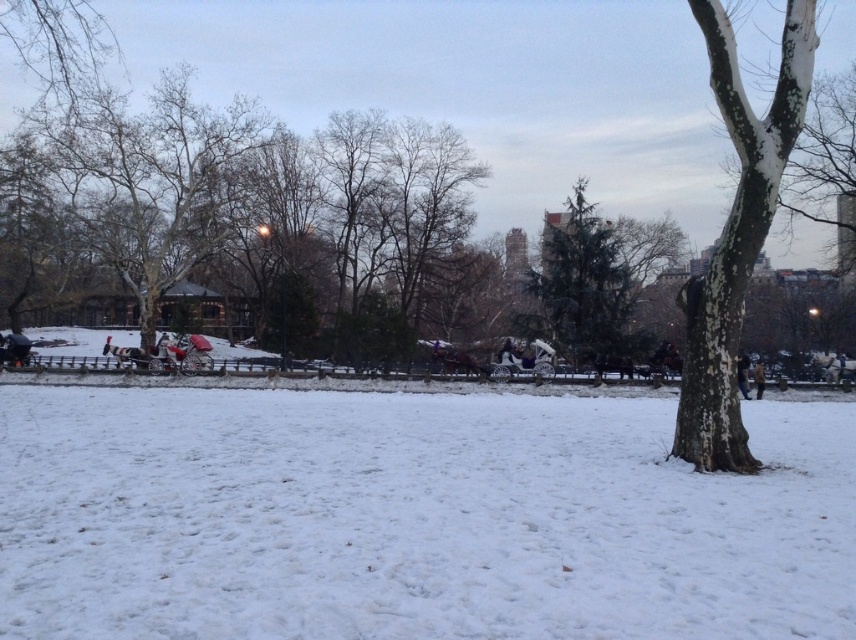
Does white fluffy snow at center have a greater height compared to white textured bark at center?

In fact, white fluffy snow at center may be shorter than white textured bark at center.

Who is higher up, white fluffy snow at center or white textured bark at center?

→ white textured bark at center

Between point (298, 468) and point (794, 51), which one is positioned behind?

The point (794, 51) is behind.

This screenshot has width=856, height=640. In order to click on white fluffy snow at center in this screenshot , I will do `click(414, 516)`.

Between white textured bark at center and green textured tree at center, which one has less height?

With less height is white textured bark at center.

The height and width of the screenshot is (640, 856). Describe the element at coordinates (738, 230) in the screenshot. I see `white textured bark at center` at that location.

The height and width of the screenshot is (640, 856). I want to click on white textured bark at center, so click(738, 230).

Is white textured bark at center taller than dark brown leather coat at center?

Correct, white textured bark at center is much taller as dark brown leather coat at center.

Based on the photo, who is positioned more to the right, white textured bark at center or dark brown leather coat at center?

dark brown leather coat at center is more to the right.

Does point (702, 4) come farther from viewer compared to point (746, 396)?

No, it is not.

Find the location of a particular element. The image size is (856, 640). white textured bark at center is located at coordinates (738, 230).